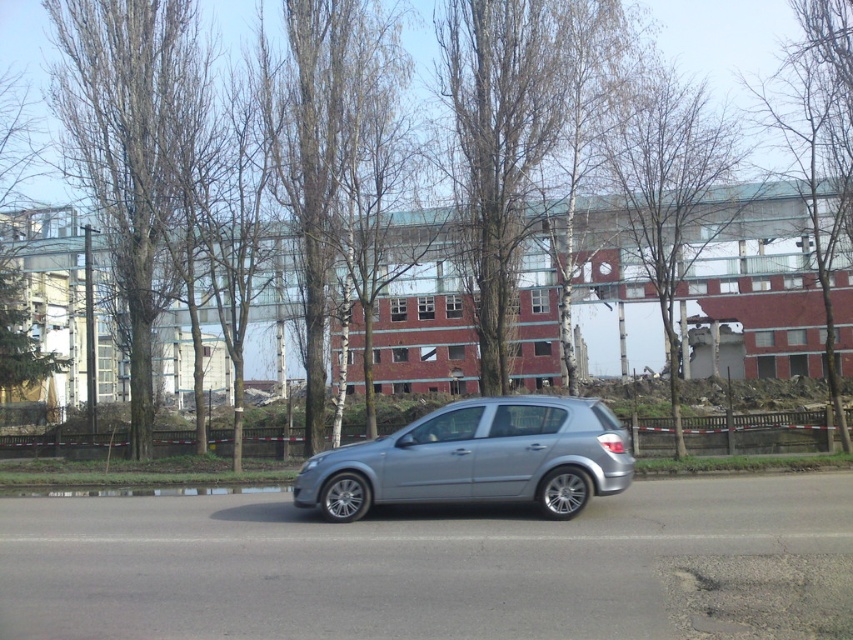
Is point (590, 328) farther from viewer compared to point (793, 76)?

Yes, point (590, 328) is behind point (793, 76).

You are a GUI agent. You are given a task and a screenshot of the screen. Output one action in this format:
    pyautogui.click(x=<x>, y=<y>)
    Task: Click on the brown bark tree at center
    
    Given the screenshot: What is the action you would take?
    pyautogui.click(x=723, y=40)

Is the position of satin silver car at center more distant than that of bare wood tree at upper right?

No.

Does satin silver car at center have a lesser height compared to bare wood tree at upper right?

Yes, satin silver car at center is shorter than bare wood tree at upper right.

Is point (618, 486) positioned in front of point (792, 116)?

Yes, point (618, 486) is in front of point (792, 116).

The height and width of the screenshot is (640, 853). Find the location of `satin silver car at center`. satin silver car at center is located at coordinates (477, 460).

Looking at this image, can you confirm if satin silver car at center is smaller than smooth bark tree at upper center?

Correct, satin silver car at center occupies less space than smooth bark tree at upper center.

Is satin silver car at center closer to the viewer compared to smooth bark tree at upper center?

Yes, it is in front of smooth bark tree at upper center.

The width and height of the screenshot is (853, 640). Identify the location of satin silver car at center. (477, 460).